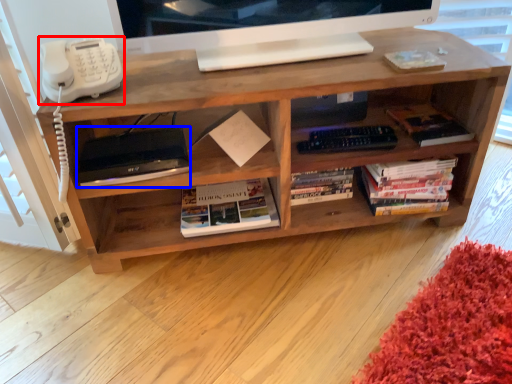
Question: Which object is closer to the camera taking this photo, corded phone (highlighted by a red box) or equipment (highlighted by a blue box)?

Choices:
 (A) corded phone
 (B) equipment

Answer: (A)